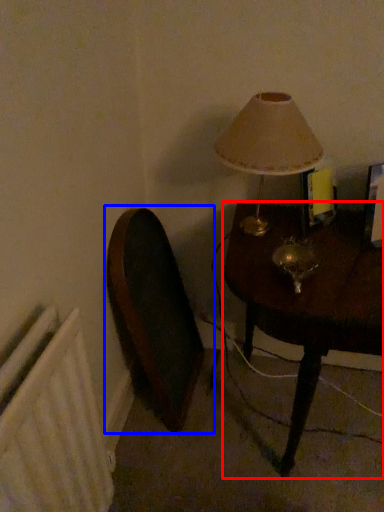
Question: Among these objects, which one is nearest to the camera, table (highlighted by a red box) or swivel chair (highlighted by a blue box)?

Choices:
 (A) table
 (B) swivel chair

Answer: (A)